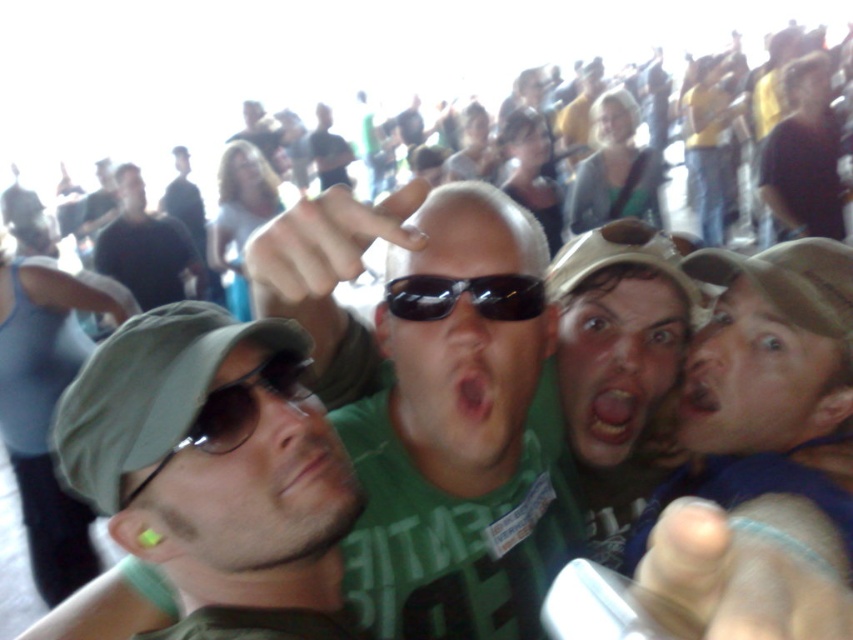
You are a photographer trying to capture a clear shot of the green matte cap at left and the sunglasses at center. Which object should you adjust your focus to ensure it appears larger in the photo?

The green matte cap at left is taller than sunglasses at center, so focusing on the green matte cap at left would make it appear larger in the photo.

You are a photographer at the event and want to ensure that both the dark gray cap at left and the sunglasses at center are visible in your shot. Based on their positions, which object should you focus on to capture both in the frame?

Since the dark gray cap at left is much taller than the sunglasses at center, you should focus on the dark gray cap at left to ensure both are visible in the frame.